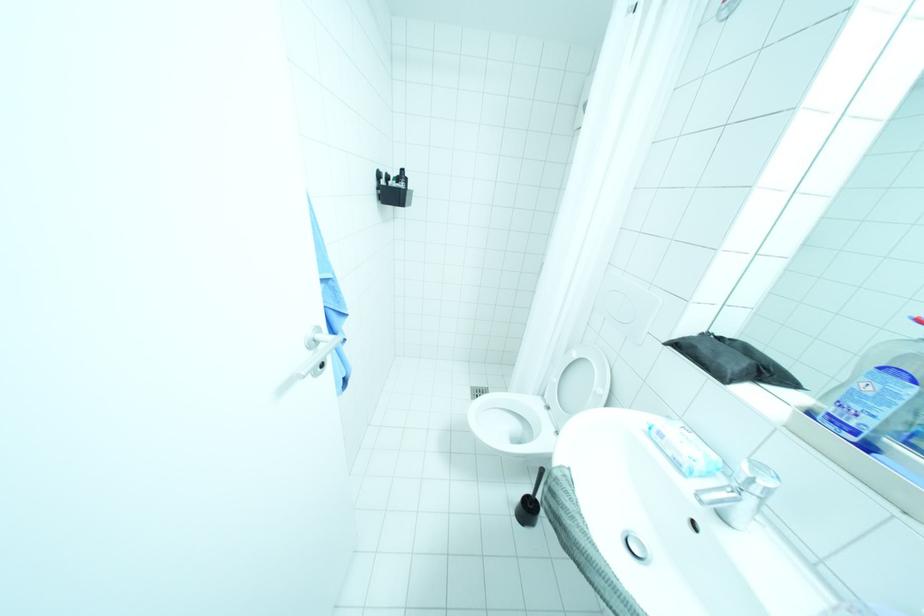
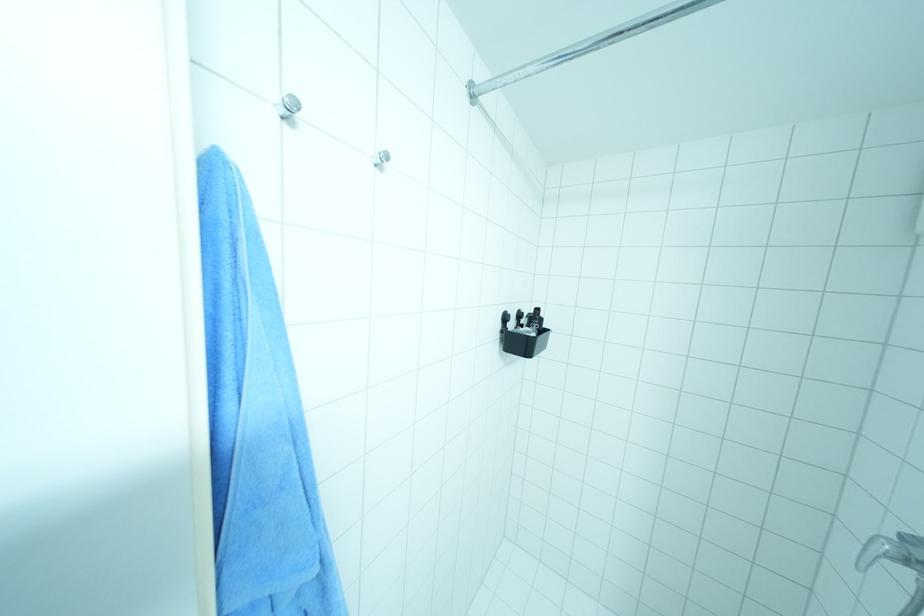
Where in the second image is the point corresponding to point 407,182 from the first image?

(538, 323)